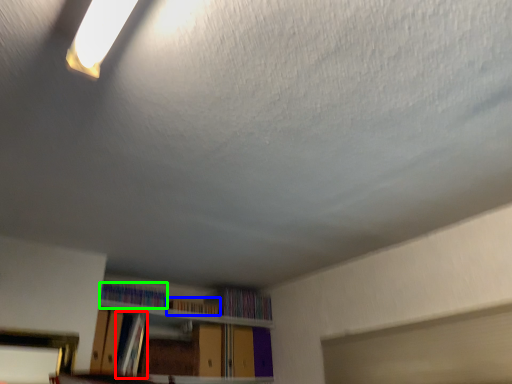
Question: Considering the real-world distances, which object is closest to book (highlighted by a red box)? book (highlighted by a blue box) or book (highlighted by a green box).

Choices:
 (A) book
 (B) book

Answer: (B)